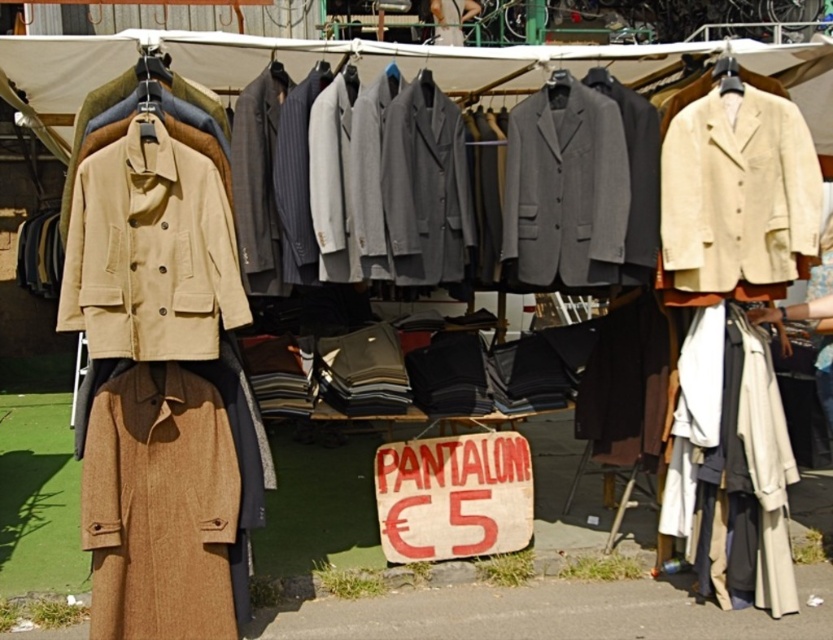
Question: Is gray wool blazer at center bigger than beige fabric coat at right?

Choices:
 (A) yes
 (B) no

Answer: (B)

Question: Which object is farther from the camera taking this photo?

Choices:
 (A) gray wool blazer at center
 (B) beige fabric coat at right
 (C) beige corduroy blazer at upper right

Answer: (B)

Question: Does beige cotton coat at left appear under beige fabric coat at right?

Choices:
 (A) yes
 (B) no

Answer: (B)

Question: Does gray wool blazer at center appear under beige fabric coat at right?

Choices:
 (A) yes
 (B) no

Answer: (B)

Question: Which object is closer to the camera taking this photo?

Choices:
 (A) beige fabric coat at right
 (B) gray wool blazer at center
 (C) beige cotton coat at left

Answer: (C)

Question: Estimate the real-world distances between objects in this image. Which object is farther from the beige fabric coat at right?

Choices:
 (A) beige cotton coat at left
 (B) beige corduroy blazer at upper right
 (C) gray wool blazer at center

Answer: (A)